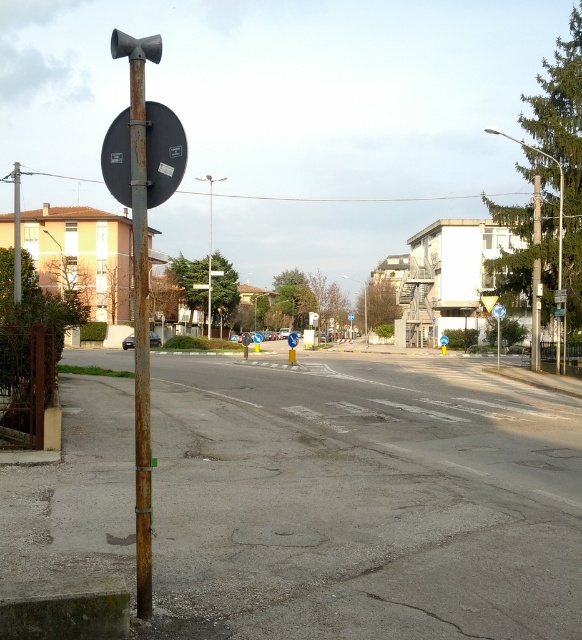
Question: Which object is closer to the camera taking this photo?

Choices:
 (A) matte black traffic light at upper left
 (B) blue plastic triangle at upper center
 (C) metallic reflective sign at upper center
 (D) metallic pole at right

Answer: (A)

Question: Is matte black traffic light at upper left positioned at the back of blue plastic triangle at upper center?

Choices:
 (A) no
 (B) yes

Answer: (A)

Question: Which of these objects is positioned closest to the blue plastic triangle at upper center?

Choices:
 (A) matte black traffic light at upper left
 (B) rusty metal pole at left
 (C) metallic reflective sign at upper center
 (D) metallic pole at right

Answer: (C)

Question: Which object appears farthest from the camera in this image?

Choices:
 (A) metallic reflective sign at upper center
 (B) matte black traffic light at upper left
 (C) rusty metal pole at left

Answer: (A)

Question: In this image, where is rusty metal pole at left located relative to metallic reflective sign at upper center?

Choices:
 (A) right
 (B) left

Answer: (B)

Question: Can you confirm if metallic pole at right is thinner than matte black traffic light at upper left?

Choices:
 (A) yes
 (B) no

Answer: (A)